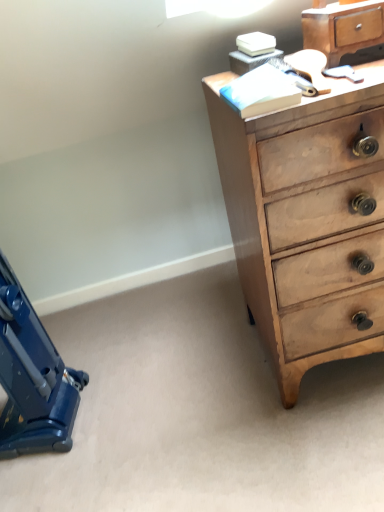
Question: Is light brown wood chest of drawers at upper right facing towards blue plastic vacuum cleaner at lower left?

Choices:
 (A) no
 (B) yes

Answer: (A)

Question: From the image's perspective, is light brown wood chest of drawers at upper right on top of blue plastic vacuum cleaner at lower left?

Choices:
 (A) yes
 (B) no

Answer: (A)

Question: Is light brown wood chest of drawers at upper right to the right of blue plastic vacuum cleaner at lower left from the viewer's perspective?

Choices:
 (A) yes
 (B) no

Answer: (A)

Question: Is light brown wood chest of drawers at upper right at the left side of blue plastic vacuum cleaner at lower left?

Choices:
 (A) yes
 (B) no

Answer: (B)

Question: Is the position of light brown wood chest of drawers at upper right more distant than that of blue plastic vacuum cleaner at lower left?

Choices:
 (A) yes
 (B) no

Answer: (B)

Question: From a real-world perspective, is light brown wood chest of drawers at upper right beneath blue plastic vacuum cleaner at lower left?

Choices:
 (A) no
 (B) yes

Answer: (A)

Question: Is wooden chest of drawers at upper right next to light brown wood chest of drawers at upper right?

Choices:
 (A) no
 (B) yes

Answer: (A)

Question: Is wooden chest of drawers at upper right facing away from light brown wood chest of drawers at upper right?

Choices:
 (A) yes
 (B) no

Answer: (B)

Question: Considering the relative sizes of wooden chest of drawers at upper right and light brown wood chest of drawers at upper right in the image provided, is wooden chest of drawers at upper right smaller than light brown wood chest of drawers at upper right?

Choices:
 (A) no
 (B) yes

Answer: (B)

Question: Considering the relative sizes of wooden chest of drawers at upper right and light brown wood chest of drawers at upper right in the image provided, is wooden chest of drawers at upper right bigger than light brown wood chest of drawers at upper right?

Choices:
 (A) yes
 (B) no

Answer: (B)

Question: Is wooden chest of drawers at upper right wider than light brown wood chest of drawers at upper right?

Choices:
 (A) yes
 (B) no

Answer: (B)

Question: From a real-world perspective, is wooden chest of drawers at upper right positioned over light brown wood chest of drawers at upper right based on gravity?

Choices:
 (A) yes
 (B) no

Answer: (A)

Question: Would you say blue plastic vacuum cleaner at lower left is outside light brown wood chest of drawers at upper right?

Choices:
 (A) yes
 (B) no

Answer: (A)